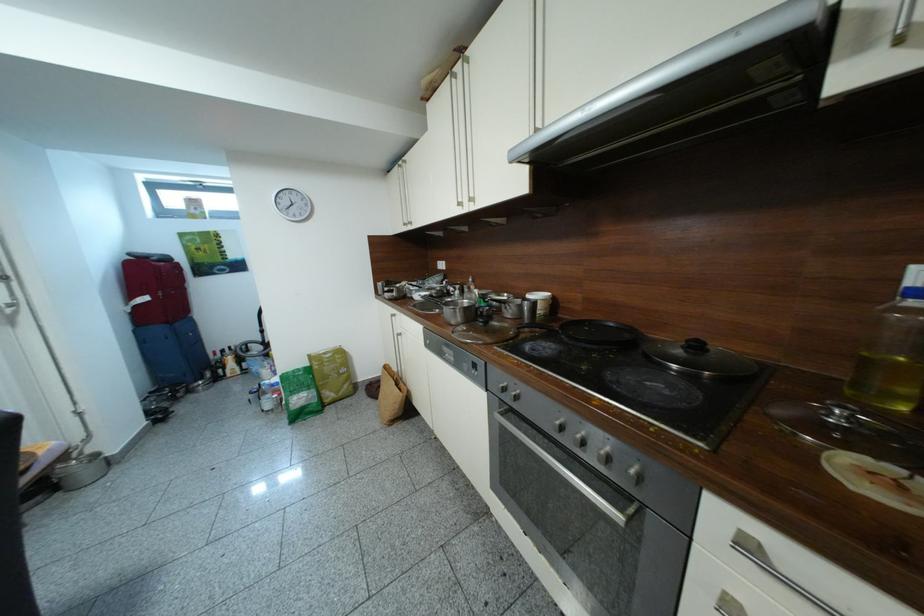
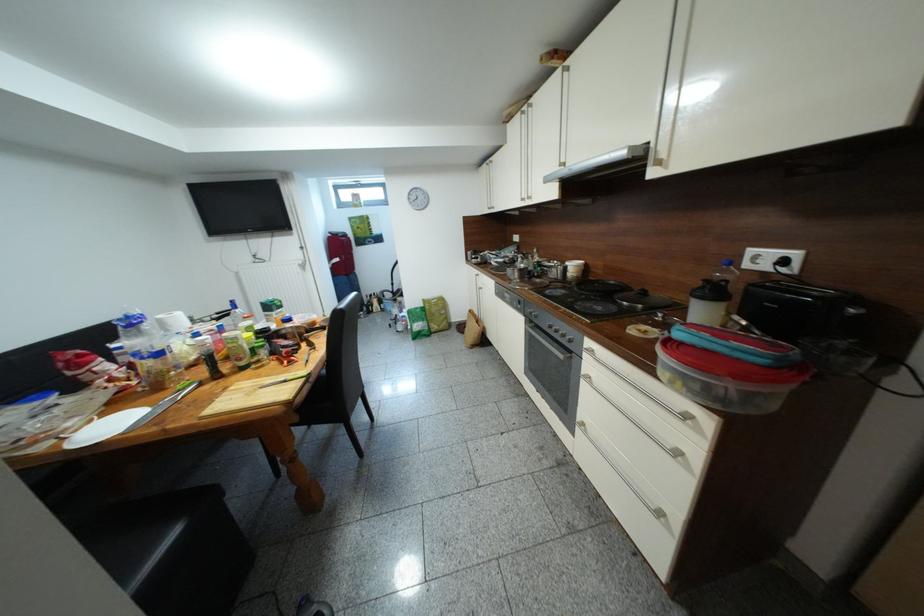
Question: The camera is either moving clockwise (left) or counter-clockwise (right) around the object. The first image is from the beginning of the video and the second image is from the end. Is the camera moving left or right when shooting the video?

Choices:
 (A) Left
 (B) Right

Answer: (B)